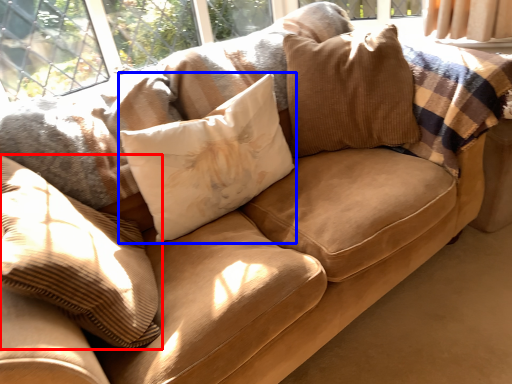
Question: Among these objects, which one is nearest to the camera, pillow (highlighted by a red box) or pillow (highlighted by a blue box)?

Choices:
 (A) pillow
 (B) pillow

Answer: (A)